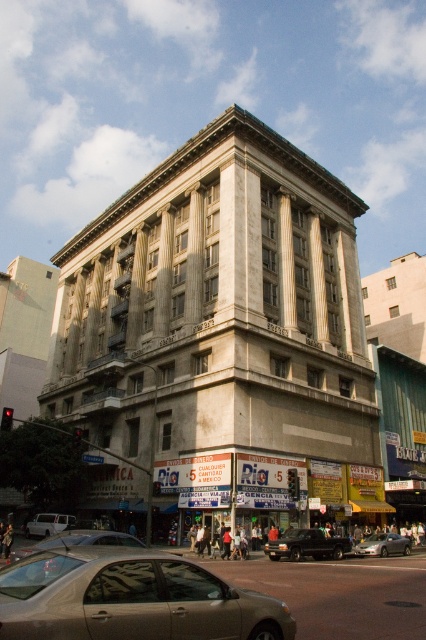
Based on the photo, you are a delivery driver who needs to park your vehicle in front of the building. There is a gold metallic sedan at lower left and a black glossy van at center. Which vehicle is closer to the right side of the parking area?

The black glossy van at center is closer to the right side of the parking area because the gold metallic sedan at lower left is positioned to its left.

You are a delivery person needing to park your van in the area shown. You have a black glossy van at center and a silver metallic van at lower left. Which van is closer to the storefront with the Ria sign?

The black glossy van at center is 26.85 meters from the silver metallic van at lower left. However, the distance between the vans does not indicate their proximity to the Ria sign. Without information on their positions relative to the storefront, it is impossible to determine which van is closer.

You are a delivery driver who needs to park your black glossy van at center in a spot that is exactly at coordinate point 0.853, 0.721. Can you confirm if the van is already parked correctly?

The position of black glossy van at center is at point (307, 545), so yes, the van is already parked correctly at that exact coordinate point.